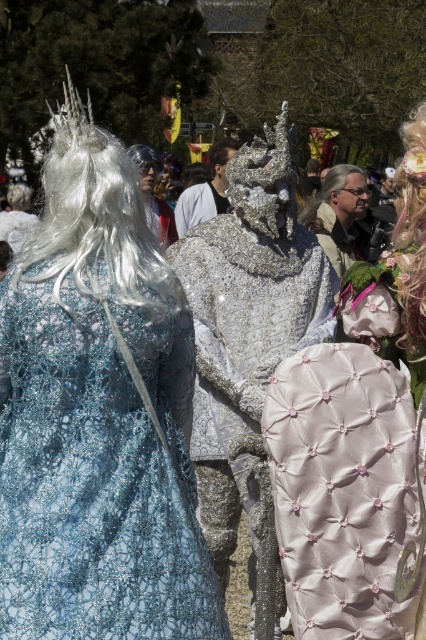
Based on the photo, you are a photographer at the festival and want to capture a photo that includes both the shiny silver armor at center and the white glittery wig at upper left. Based on their positions, which object should be placed closer to the bottom of the frame?

The shiny silver armor at center should be placed closer to the bottom of the frame because it is positioned below the white glittery wig at upper left.